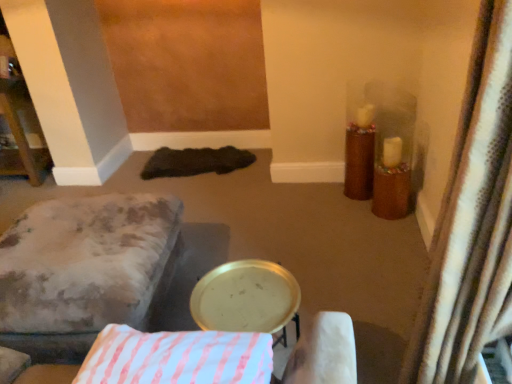
Locate an element on the screen. free space above white striped fabric pillow at center (from a real-world perspective) is located at coordinates (175, 353).